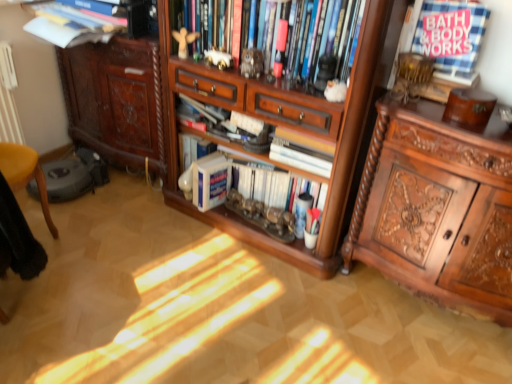
Where is `blank area to the left of polished wood cabinet at right, the second cabinetry positioned from the left`? Image resolution: width=512 pixels, height=384 pixels. blank area to the left of polished wood cabinet at right, the second cabinetry positioned from the left is located at coordinates (310, 317).